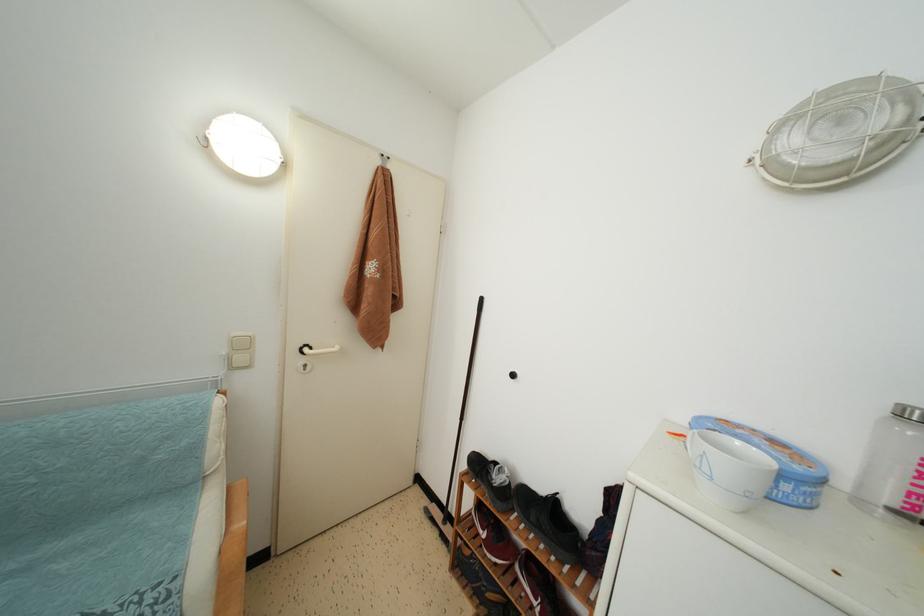
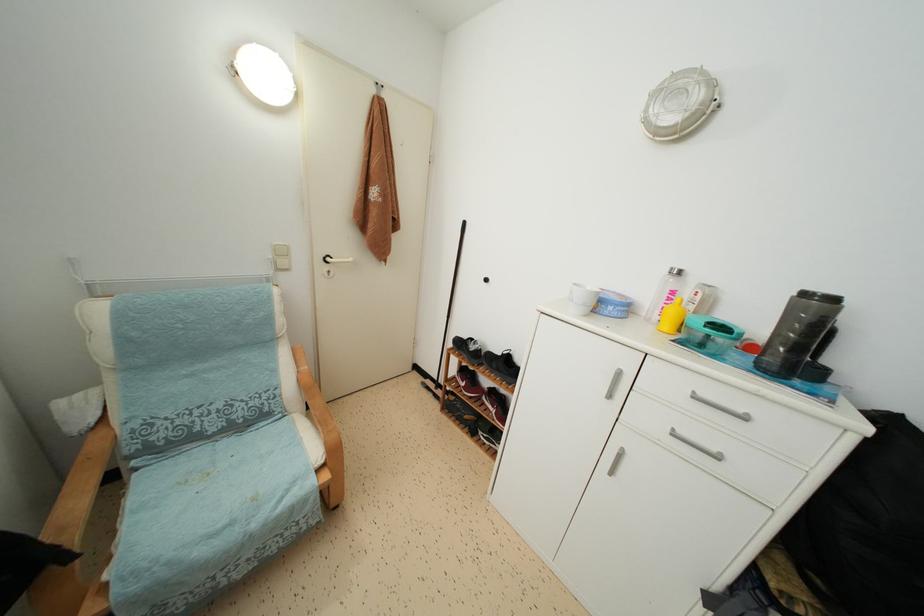
The point at (473, 520) is marked in the first image. Where is the corresponding point in the second image?

(457, 383)